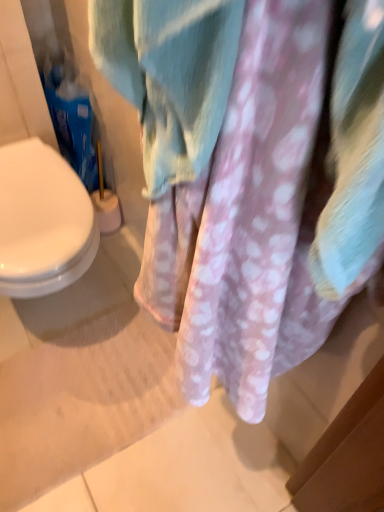
Describe the element at coordinates (249, 175) in the screenshot. The width and height of the screenshot is (384, 512). I see `pink fuzzy towel at center` at that location.

Image resolution: width=384 pixels, height=512 pixels. Find the location of `pink fuzzy towel at center`. pink fuzzy towel at center is located at coordinates (249, 175).

Where is `white plastic brush at lower left`? Image resolution: width=384 pixels, height=512 pixels. white plastic brush at lower left is located at coordinates (106, 201).

What do you see at coordinates (106, 201) in the screenshot? Image resolution: width=384 pixels, height=512 pixels. I see `white plastic brush at lower left` at bounding box center [106, 201].

Measure the distance between point (120, 215) and camera.

Point (120, 215) is 1.54 meters from camera.

Where is `pink fuzzy towel at center`? The height and width of the screenshot is (512, 384). pink fuzzy towel at center is located at coordinates (249, 175).

Which is more to the right, white plastic brush at lower left or pink fuzzy towel at center?

From the viewer's perspective, pink fuzzy towel at center appears more on the right side.

Which object is further away from the camera taking this photo, white plastic brush at lower left or pink fuzzy towel at center?

Positioned behind is white plastic brush at lower left.

Considering the positions of point (105, 198) and point (140, 284), is point (105, 198) closer or farther from the camera than point (140, 284)?

Point (105, 198) is positioned farther from the camera compared to point (140, 284).

From the image's perspective, is white plastic brush at lower left located above or below pink fuzzy towel at center?

From the image's perspective, white plastic brush at lower left appears above pink fuzzy towel at center.

From a real-world perspective, which object stands above the other?

pink fuzzy towel at center.

Does white plastic brush at lower left have a lesser width compared to pink fuzzy towel at center?

Incorrect, the width of white plastic brush at lower left is not less than that of pink fuzzy towel at center.

Is white plastic brush at lower left taller than pink fuzzy towel at center?

Incorrect, the height of white plastic brush at lower left is not larger of that of pink fuzzy towel at center.

Is white plastic brush at lower left smaller than pink fuzzy towel at center?

Yes, white plastic brush at lower left is smaller than pink fuzzy towel at center.

Could pink fuzzy towel at center be considered to be inside white plastic brush at lower left?

No, pink fuzzy towel at center is not surrounded by white plastic brush at lower left.

Is there a large distance between white plastic brush at lower left and pink fuzzy towel at center?

white plastic brush at lower left is positioned a significant distance from pink fuzzy towel at center.

Is white plastic brush at lower left turned away from pink fuzzy towel at center?

No, white plastic brush at lower left is not facing the opposite direction of pink fuzzy towel at center.

How many degrees apart are the facing directions of white plastic brush at lower left and pink fuzzy towel at center?

89.8 degrees.

This screenshot has width=384, height=512. Identify the location of laundry above the white plastic brush at lower left (from a real-world perspective). (249, 175).

Is pink fuzzy towel at center at the left side of white plastic brush at lower left?

No.

Does pink fuzzy towel at center come behind white plastic brush at lower left?

No, it is in front of white plastic brush at lower left.

Is point (298, 149) more distant than point (115, 226)?

No, it is not.

From the image's perspective, is pink fuzzy towel at center located above or below white plastic brush at lower left?

pink fuzzy towel at center is below white plastic brush at lower left.

From a real-world perspective, is pink fuzzy towel at center below white plastic brush at lower left?

Incorrect, from a real-world perspective, pink fuzzy towel at center is higher than white plastic brush at lower left.

Looking at their sizes, would you say pink fuzzy towel at center is wider or thinner than white plastic brush at lower left?

In the image, pink fuzzy towel at center appears to be more narrow than white plastic brush at lower left.

Does pink fuzzy towel at center have a lesser height compared to white plastic brush at lower left?

No.

Between pink fuzzy towel at center and white plastic brush at lower left, which one has larger size?

pink fuzzy towel at center is bigger.

Would you say pink fuzzy towel at center contains white plastic brush at lower left?

No, white plastic brush at lower left is located outside of pink fuzzy towel at center.

Does pink fuzzy towel at center touch white plastic brush at lower left?

There is a gap between pink fuzzy towel at center and white plastic brush at lower left.

Is white plastic brush at lower left at the back of pink fuzzy towel at center?

No, pink fuzzy towel at center is not facing away from white plastic brush at lower left.

Where is `brush lying behind the pink fuzzy towel at center`? This screenshot has height=512, width=384. brush lying behind the pink fuzzy towel at center is located at coordinates (106, 201).

You are a GUI agent. You are given a task and a screenshot of the screen. Output one action in this format:
    pyautogui.click(x=<x>, y=<y>)
    Task: Click on the brush that is on the left side of pink fuzzy towel at center
    The width and height of the screenshot is (384, 512).
    Given the screenshot: What is the action you would take?
    pyautogui.click(x=106, y=201)

Locate an element on the screen. This screenshot has height=512, width=384. brush behind the pink fuzzy towel at center is located at coordinates (106, 201).